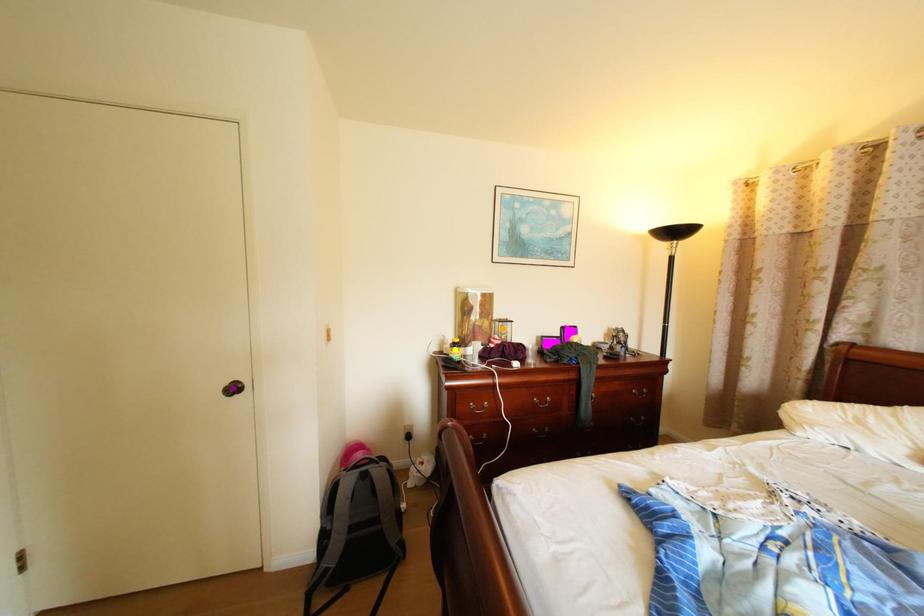
Order these from nearest to farthest:
A) purple point
B) yellow point
C) orange point

1. orange point
2. yellow point
3. purple point